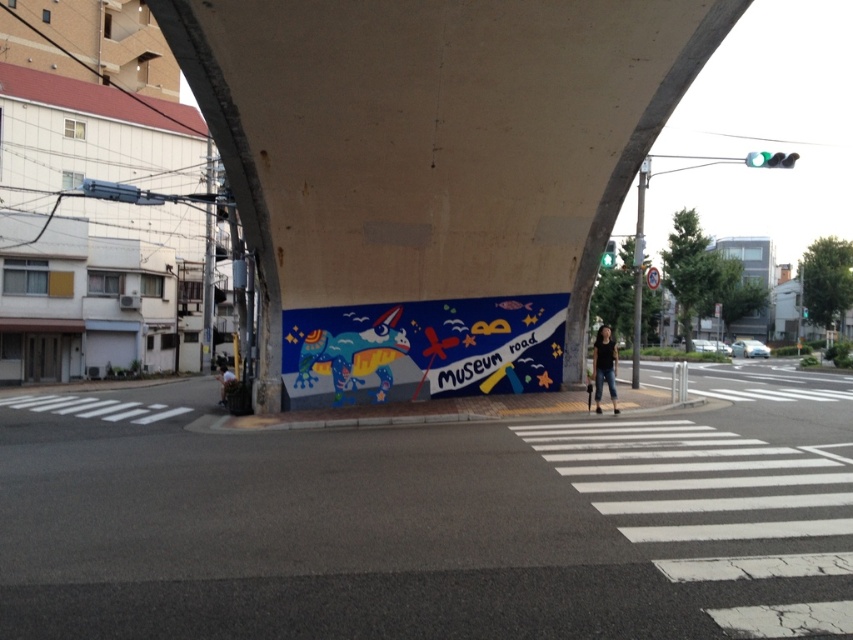
You are standing on the street and want to find the painted mural at center. According to the scene description, where should you look relative to the overpass?

The painted mural at center is located below the overpass, as it is described as being beneath the overpass structure in the scene description.